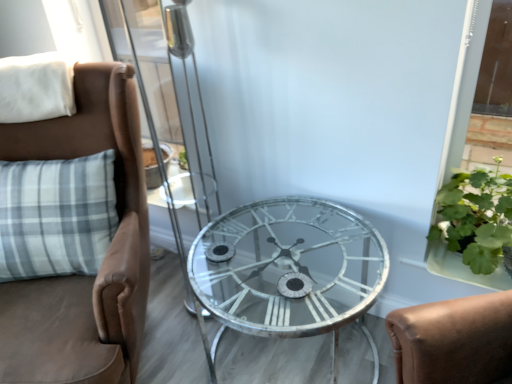
Question: Is brown leather chair at left wider or thinner than transparent glass screen door at center?

Choices:
 (A) thin
 (B) wide

Answer: (B)

Question: Choose the correct answer: Is brown leather chair at left inside transparent glass screen door at center or outside it?

Choices:
 (A) outside
 (B) inside

Answer: (A)

Question: Based on their relative distances, which object is nearer to the clear glass table at center?

Choices:
 (A) brown leather chair at left
 (B) green leafy plant at right
 (C) white soft pillow at upper left
 (D) transparent glass screen door at center
 (E) metallic silver clock face at center

Answer: (E)

Question: Which object is the farthest from the metallic silver clock face at center?

Choices:
 (A) white soft pillow at upper left
 (B) green leafy plant at right
 (C) brown leather chair at left
 (D) clear glass table at center
 (E) transparent glass screen door at center

Answer: (E)